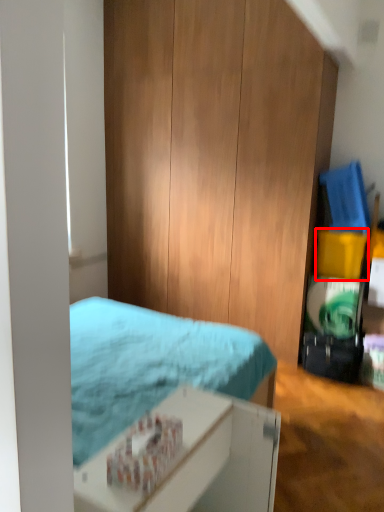
Question: From the image's perspective, where is box (annotated by the red box) located in relation to bed in the image?

Choices:
 (A) above
 (B) below

Answer: (A)